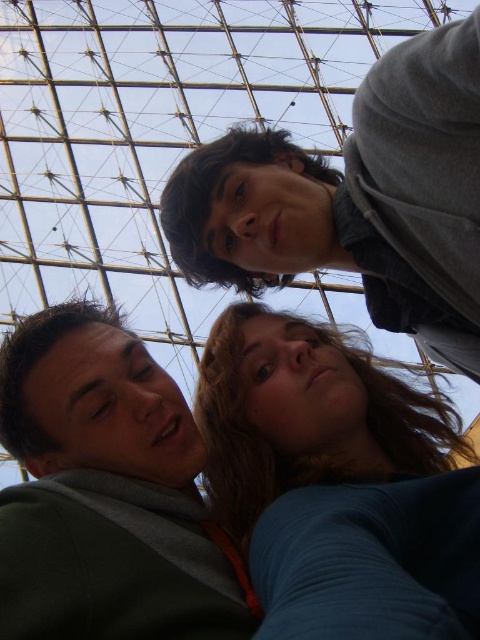
Between point (351, 257) and point (27, 461), which one is positioned behind?

The point (351, 257) is behind.

Who is positioned more to the left, dark gray hoodie at upper center or green matte jacket at lower left?

From the viewer's perspective, green matte jacket at lower left appears more on the left side.

This screenshot has width=480, height=640. I want to click on dark gray hoodie at upper center, so click(357, 198).

Locate an element on the screen. Image resolution: width=480 pixels, height=640 pixels. dark gray hoodie at upper center is located at coordinates click(357, 198).

Does blue fabric at center appear under dark gray hoodie at upper center?

Indeed, blue fabric at center is positioned under dark gray hoodie at upper center.

Image resolution: width=480 pixels, height=640 pixels. In order to click on blue fabric at center in this screenshot , I will do `click(336, 483)`.

The height and width of the screenshot is (640, 480). I want to click on blue fabric at center, so click(336, 483).

Does blue fabric at center appear on the left side of green matte jacket at lower left?

Incorrect, blue fabric at center is not on the left side of green matte jacket at lower left.

Between blue fabric at center and green matte jacket at lower left, which one has more height?

green matte jacket at lower left

Which is in front, point (212, 410) or point (118, 588)?

Positioned in front is point (118, 588).

At what (x,y) coordinates should I click in order to perform the action: click on blue fabric at center. Please return your answer as a coordinate pair (x, y). The image size is (480, 640). Looking at the image, I should click on (336, 483).